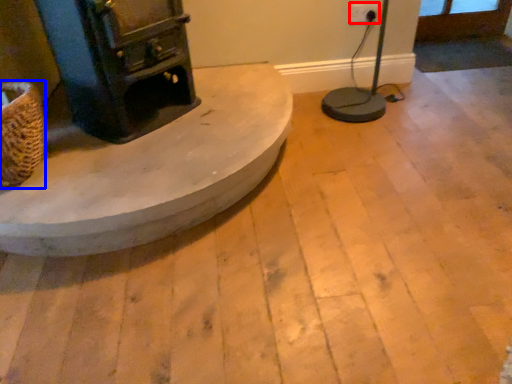
Question: Which point is closer to the camera, electric outlet (highlighted by a red box) or basket (highlighted by a blue box)?

Choices:
 (A) electric outlet
 (B) basket

Answer: (B)